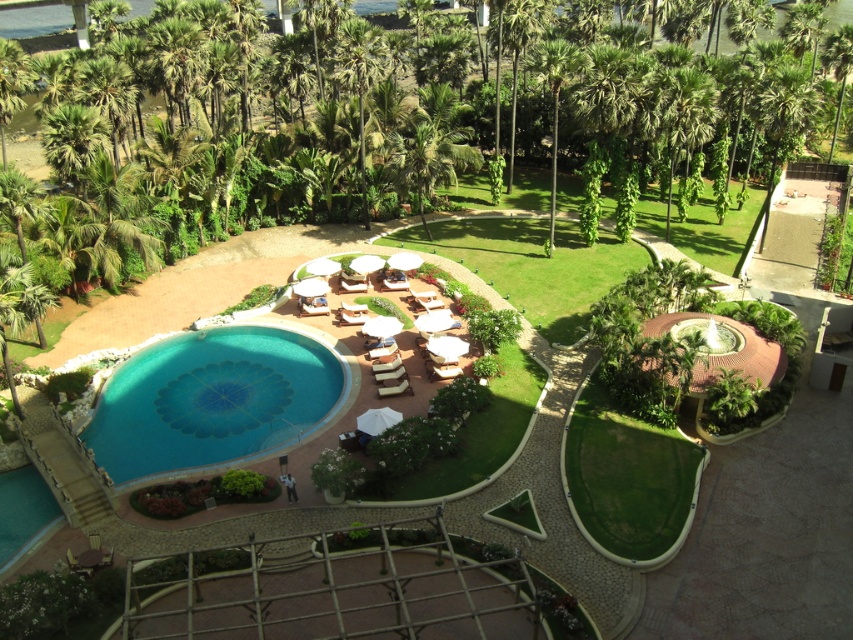
You are standing at the center of the pool and want to walk towards the green leafy palm tree at upper center. Which direction should you walk?

You should walk north because the green leafy palm tree at upper center is located at point (x=519, y=44), which is north of the pool center.

You are standing at the edge of the pool and want to take a photo of both the point at coordinates point (260, 349) and point (503, 19). Which point should you focus on first to ensure both are in clear view?

You should focus on point (260, 349) first because it is closer to the camera than point (503, 19), ensuring both points are in clear view.